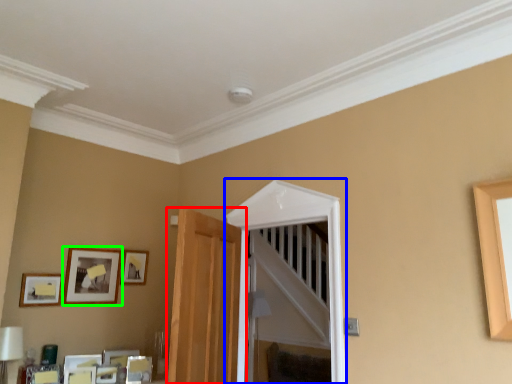
Question: Considering the real-world distances, which object is farthest from door (highlighted by a red box)? glass door (highlighted by a blue box) or picture frame (highlighted by a green box)?

Choices:
 (A) glass door
 (B) picture frame

Answer: (B)